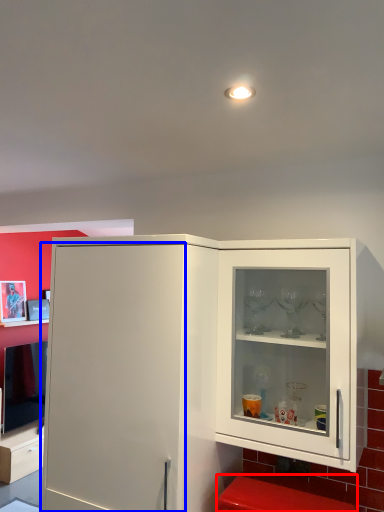
Question: Which object appears closest to the camera in this image, step stool (highlighted by a red box) or door (highlighted by a blue box)?

Choices:
 (A) step stool
 (B) door

Answer: (A)